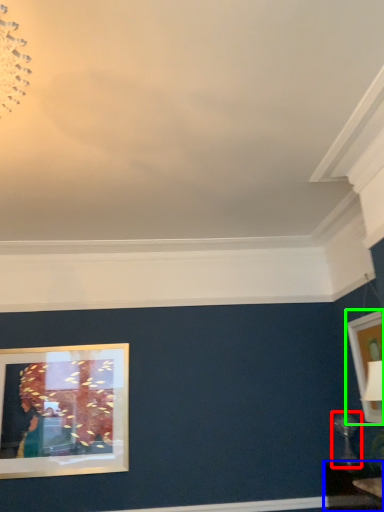
Question: Which is farther away from table lamp (highlighted by a red box)? table (highlighted by a blue box) or picture frame (highlighted by a green box)?

Choices:
 (A) table
 (B) picture frame

Answer: (B)